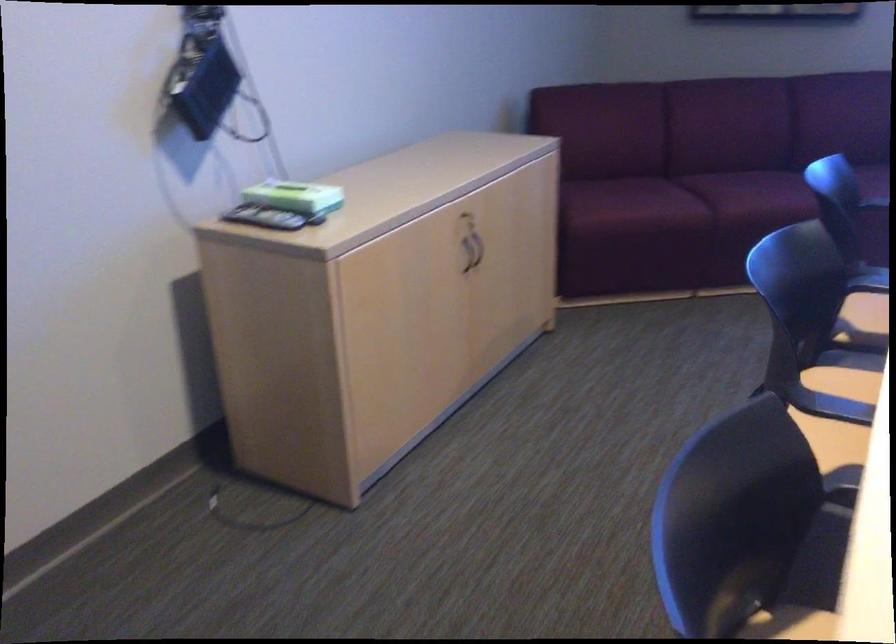
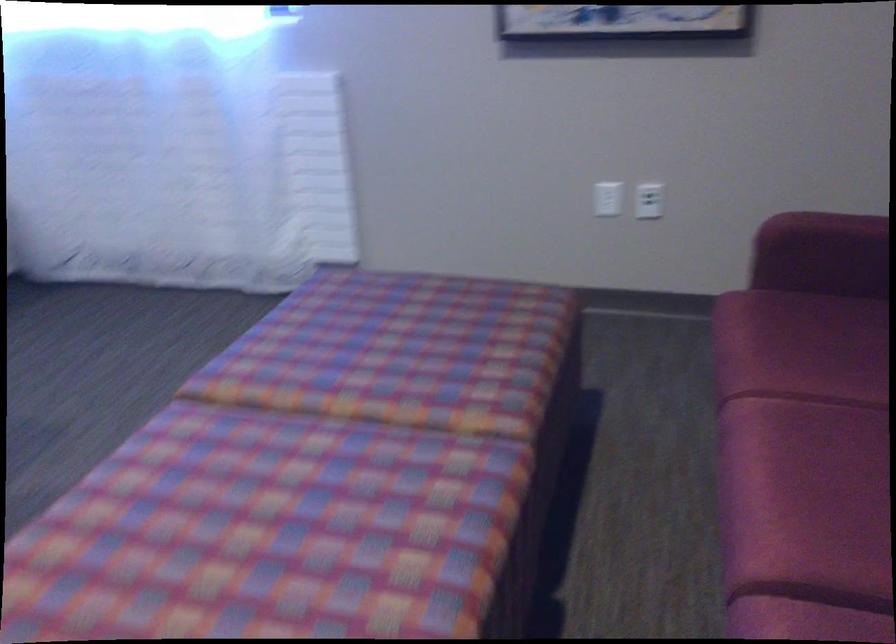
Question: What movement of the cameraman would produce the second image?

Choices:
 (A) Left
 (B) Right
 (C) Forward
 (D) Backward

Answer: (B)